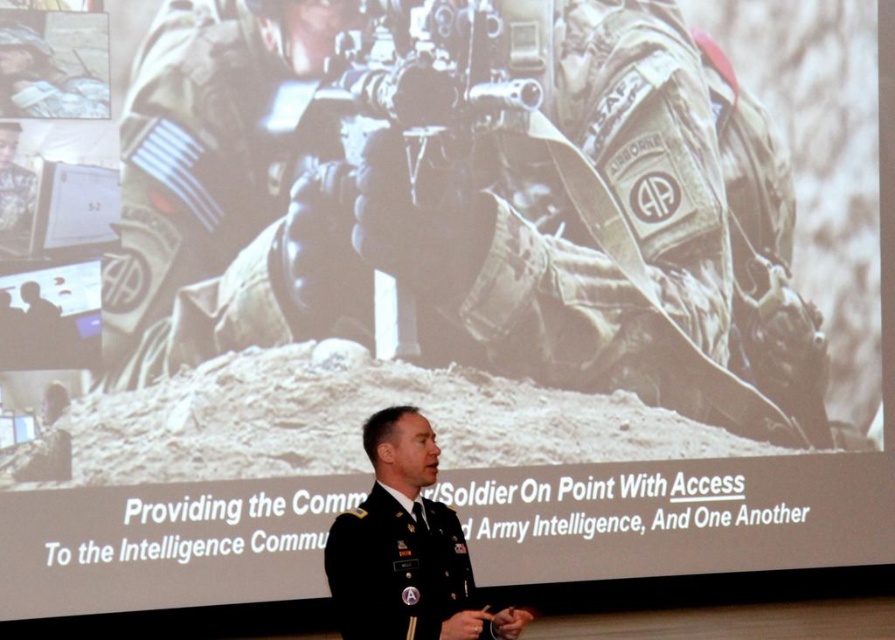
Question: Does matte black rifle at center appear under black uniform at center?

Choices:
 (A) yes
 (B) no

Answer: (B)

Question: Which point is farther from the camera taking this photo?

Choices:
 (A) (364, 620)
 (B) (449, 90)

Answer: (B)

Question: Which point appears farthest from the camera in this image?

Choices:
 (A) (381, 547)
 (B) (533, 99)

Answer: (B)

Question: Is matte black rifle at center wider than black uniform at center?

Choices:
 (A) no
 (B) yes

Answer: (B)

Question: Among these objects, which one is farthest from the camera?

Choices:
 (A) matte black rifle at center
 (B) black uniform at center

Answer: (A)

Question: Is matte black rifle at center positioned in front of black uniform at center?

Choices:
 (A) yes
 (B) no

Answer: (B)